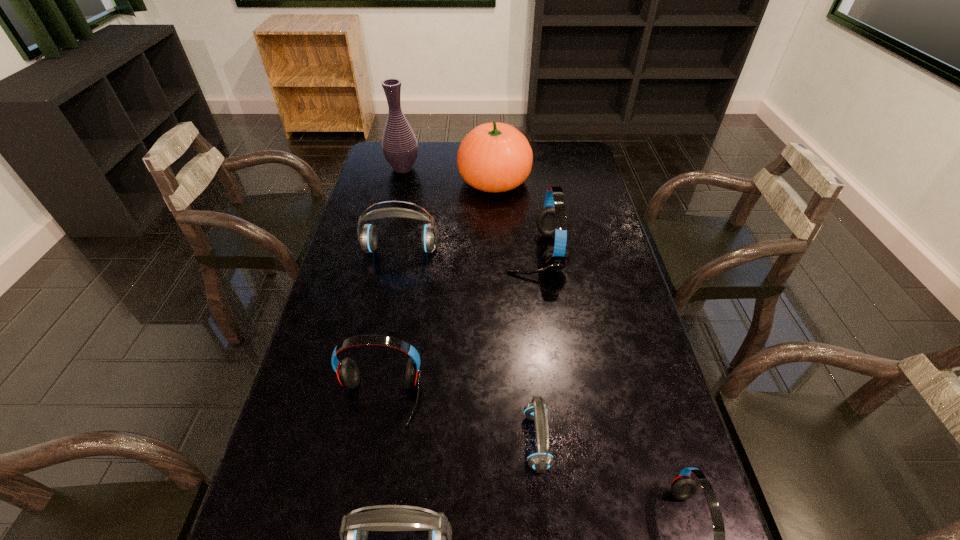
Identify the location of vase. Image resolution: width=960 pixels, height=540 pixels. (399, 144).

The height and width of the screenshot is (540, 960). In order to click on pumpkin in this screenshot , I will do `click(494, 157)`.

Identify the location of the biggest red headset. (552, 220).

The width and height of the screenshot is (960, 540). I want to click on the tallest headset, so click(552, 220).

The image size is (960, 540). Find the location of `the biggest blue headset`. the biggest blue headset is located at coordinates (367, 236).

Locate an element on the screen. the second nearest red headset is located at coordinates (347, 372).

The image size is (960, 540). Find the location of `the second biggest red headset`. the second biggest red headset is located at coordinates (347, 372).

Locate an element on the screen. This screenshot has height=540, width=960. the smallest blue headset is located at coordinates (541, 460).

The image size is (960, 540). I want to click on the shortest headset, so click(541, 460).

The image size is (960, 540). What are the coordinates of `free spot located on the right of the vase` in the screenshot? It's located at (479, 167).